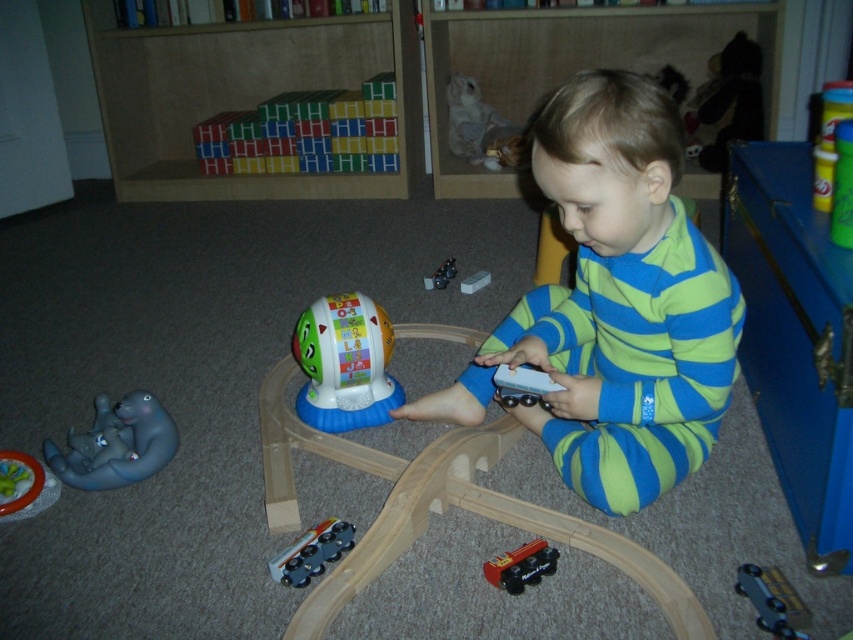
You are helping a child organize their playroom. You need to place the wooden blocks at upper center and the metallic silver train at center into a storage box. The box can only fit items that are smaller than 12 inches in any dimension. Based on the scene description, can both items fit into the box?

The wooden blocks at upper center are larger than the metallic silver train at center. Since the blocks are bigger, if they exceed 12 inches, they won

What are the coordinates of the blue striped pajamas at center?

The blue striped pajamas at center are located at coordinates point (x=614, y=305).